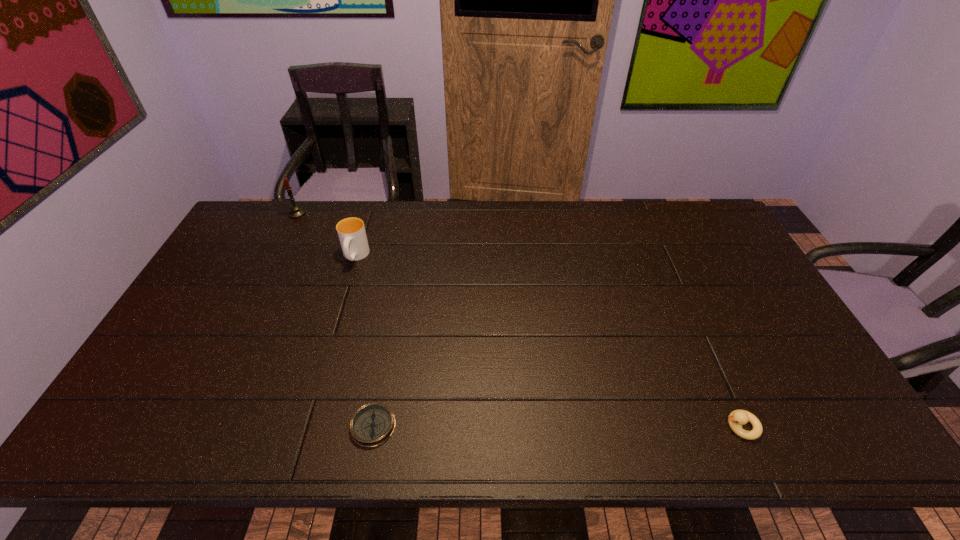
Find the location of a particular element. The width and height of the screenshot is (960, 540). free spot between the tallest object and the second object from right to left is located at coordinates (335, 320).

Identify the location of free space between the third object from left to right and the duckling. (557, 426).

Image resolution: width=960 pixels, height=540 pixels. I want to click on free space between the cup and the second object from right to left, so click(364, 341).

Locate an element on the screen. The image size is (960, 540). vacant space that's between the second object from right to left and the cup is located at coordinates (364, 341).

Select which object is the second closest to the third tallest object. Please provide its 2D coordinates. Your answer should be formatted as a tuple, i.e. [(x, y)], where the tuple contains the x and y coordinates of a point satisfying the conditions above.

[(351, 231)]

Select which object is the second closest to the second farthest object. Please provide its 2D coordinates. Your answer should be formatted as a tuple, i.e. [(x, y)], where the tuple contains the x and y coordinates of a point satisfying the conditions above.

[(372, 424)]

Locate an element on the screen. The width and height of the screenshot is (960, 540). vacant space that satisfies the following two spatial constraints: 1. with the handle on the side of the compass; 2. on the right side of the cup is located at coordinates (303, 426).

Identify the location of free space that satisfies the following two spatial constraints: 1. with the handle on the side of the cup; 2. on the right side of the compass. (303, 426).

Where is `vacant position in the image that satisfies the following two spatial constraints: 1. on the front side of the candle; 2. on the left side of the compass`? This screenshot has height=540, width=960. vacant position in the image that satisfies the following two spatial constraints: 1. on the front side of the candle; 2. on the left side of the compass is located at coordinates (190, 426).

At what (x,y) coordinates should I click in order to perform the action: click on vacant space that satisfies the following two spatial constraints: 1. with the handle on the side of the compass; 2. on the left side of the third object from right to left. Please return your answer as a coordinate pair (x, y). Image resolution: width=960 pixels, height=540 pixels. Looking at the image, I should click on (303, 426).